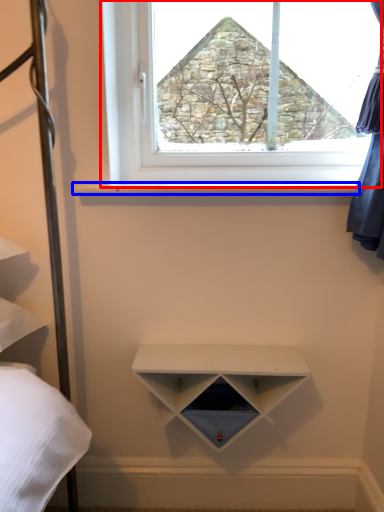
Question: Which object appears closest to the camera in this image, window (highlighted by a red box) or window sill (highlighted by a blue box)?

Choices:
 (A) window
 (B) window sill

Answer: (B)